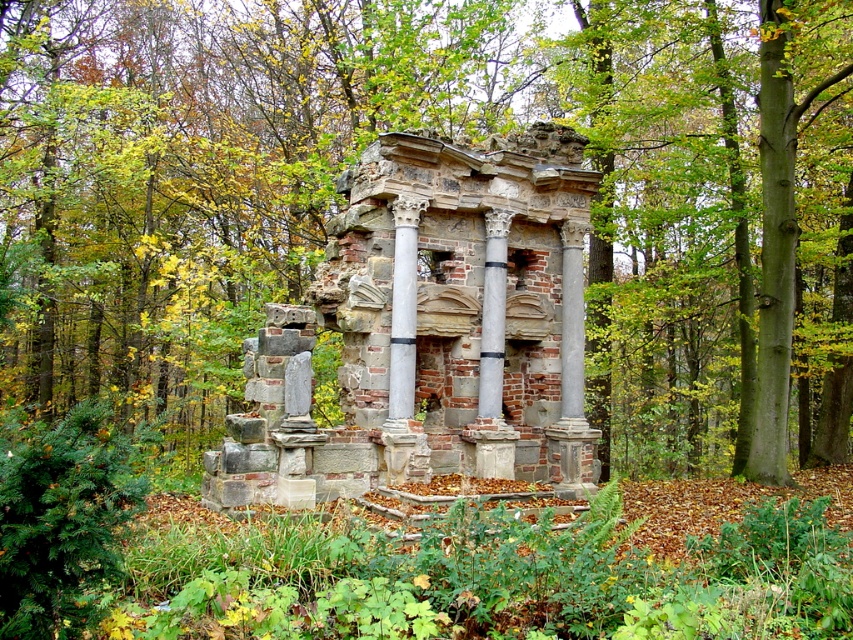
You are standing in the forest and see the point marked at coordinates (x=428, y=330). What is located at that point?

The point at coordinates (x=428, y=330) indicates brick stone ruins at center.

You are an architect examining the ancient structure. You notice the brick stone ruins at center and the white marble column at center. Which of these two objects is bigger in size?

The brick stone ruins at center is larger in size compared to the white marble column at center according to the description.

You are an archaeologist standing in front of the brick stone ruins at center and the gray stone column at center. Which structure is closer to you?

The brick stone ruins at center is closer to you since it is in front of the gray stone column at center.